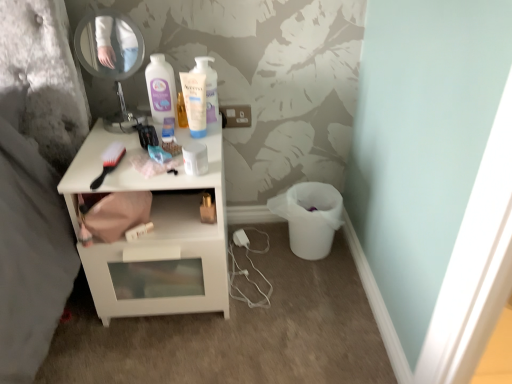
Image resolution: width=512 pixels, height=384 pixels. Identify the location of free space behind black plastic brush at upper left. (117, 146).